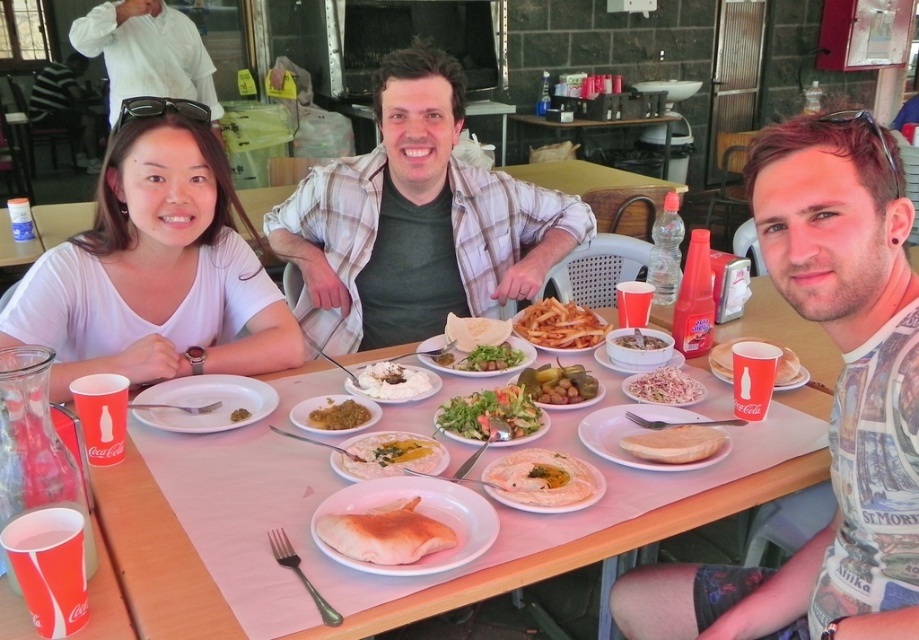
You are a waiter at the restaurant and need to deliver a drink to the customer. The customer is sitting at the table with the golden crispy fries at center and the white paper cup at right. Where should you place the new drink so it doesn

The white paper cup at right is behind the golden crispy fries at center, so you should place the new drink in front of the golden crispy fries at center to ensure it is easily accessible to the customer.

You are a waiter at the restaurant. You need to place a new drink order for the customer whose white paper cup at right is already on the table. Where should you place the new drink to avoid covering the golden crispy fries at center?

The golden crispy fries at center is above the white paper cup at right, so placing the new drink on the right side of the table away from the white paper cup at right would prevent covering the fries.

You are a server at this restaurant and need to place a new dish on the table. The dish is 12 inches in diameter. Can you fit it between the white paper placemat at center and the white matte plate at center without overlapping either?

The distance between the white paper placemat at center and the white matte plate at center is 11.09 inches. Since the dish is 12 inches in diameter, it cannot fit between them without overlapping either object.